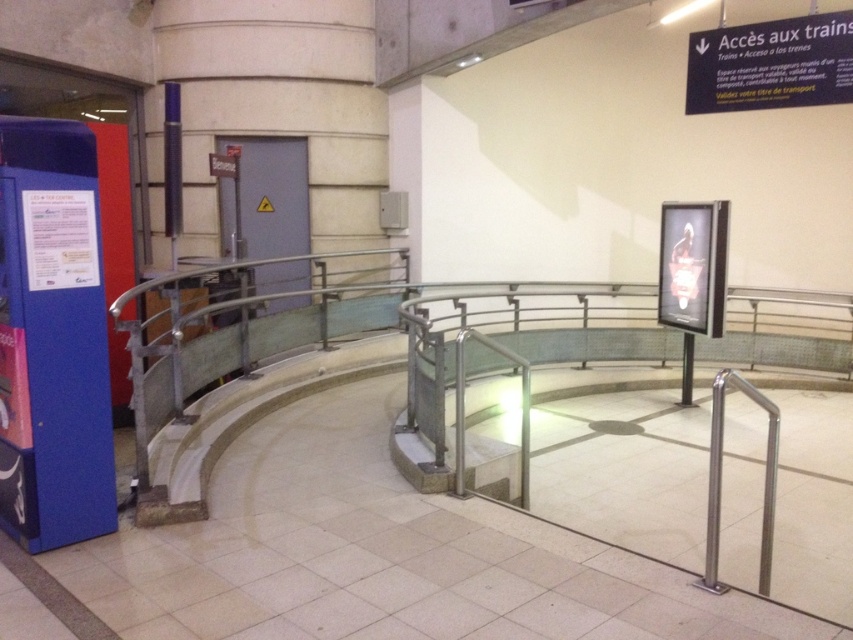
Question: Can you confirm if blue plastic vending machine at left is thinner than white plastic sign at upper right?

Choices:
 (A) yes
 (B) no

Answer: (A)

Question: Is blue plastic vending machine at left wider than white plastic sign at upper right?

Choices:
 (A) yes
 (B) no

Answer: (B)

Question: Among these objects, which one is farthest from the camera?

Choices:
 (A) blue plastic vending machine at left
 (B) white plastic sign at upper right

Answer: (B)

Question: Can you confirm if blue plastic vending machine at left is thinner than white plastic sign at upper right?

Choices:
 (A) yes
 (B) no

Answer: (A)

Question: Which object appears farthest from the camera in this image?

Choices:
 (A) white plastic sign at upper right
 (B) blue plastic vending machine at left

Answer: (A)